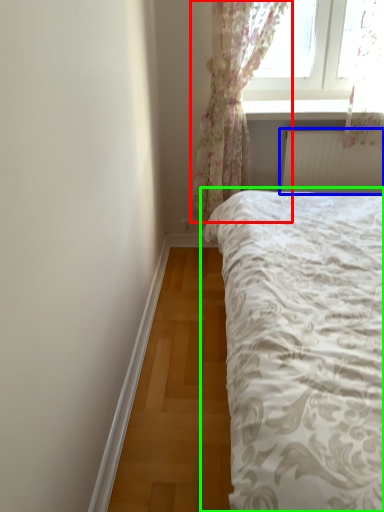
Question: Estimate the real-world distances between objects in this image. Which object is closer to curtain (highlighted by a red box), radiator (highlighted by a blue box) or bed (highlighted by a green box)?

Choices:
 (A) radiator
 (B) bed

Answer: (A)